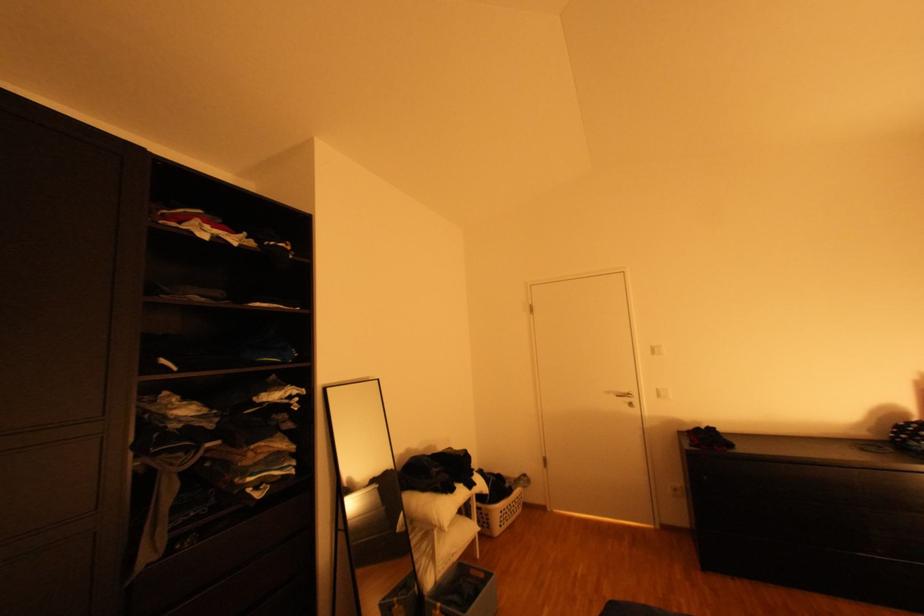
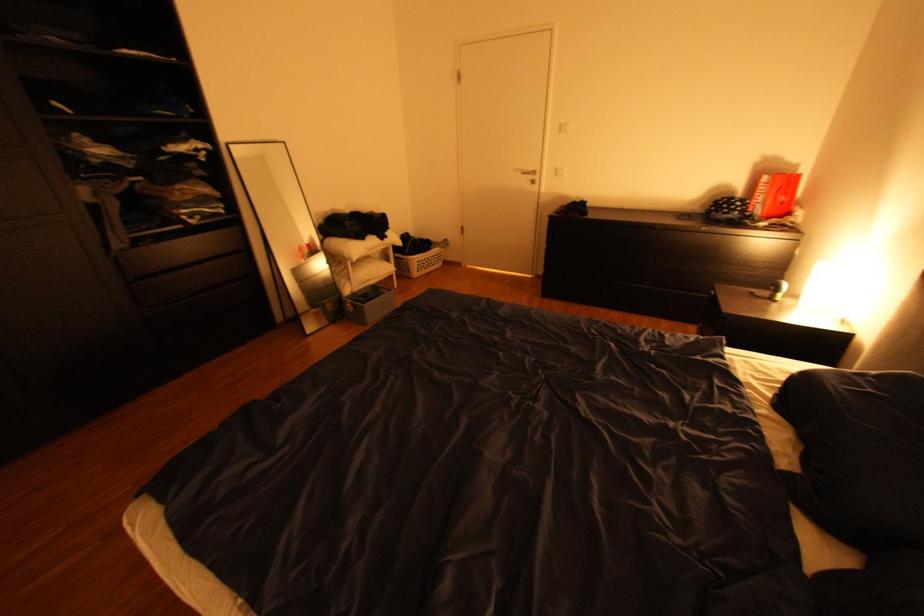
Question: Based on the continuous images, in which direction is the camera rotating? Reply with the corresponding letter.

Choices:
 (A) Left
 (B) Right
 (C) Up
 (D) Down

Answer: (D)